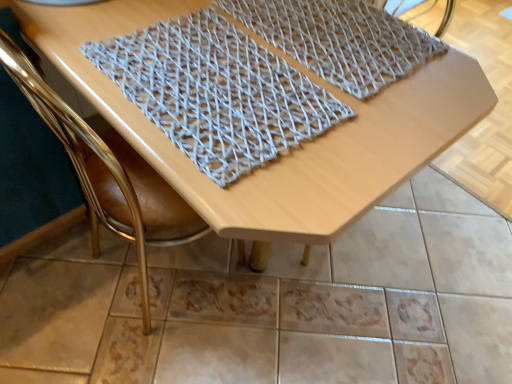
You are a GUI agent. You are given a task and a screenshot of the screen. Output one action in this format:
    pyautogui.click(x=<x>, y=<y>)
    Task: Click on the free spot to the right of knitted fabric at center, which ranks as the 2th blanket in right-to-left order
    This screenshot has height=384, width=512.
    Given the screenshot: What is the action you would take?
    pyautogui.click(x=385, y=105)